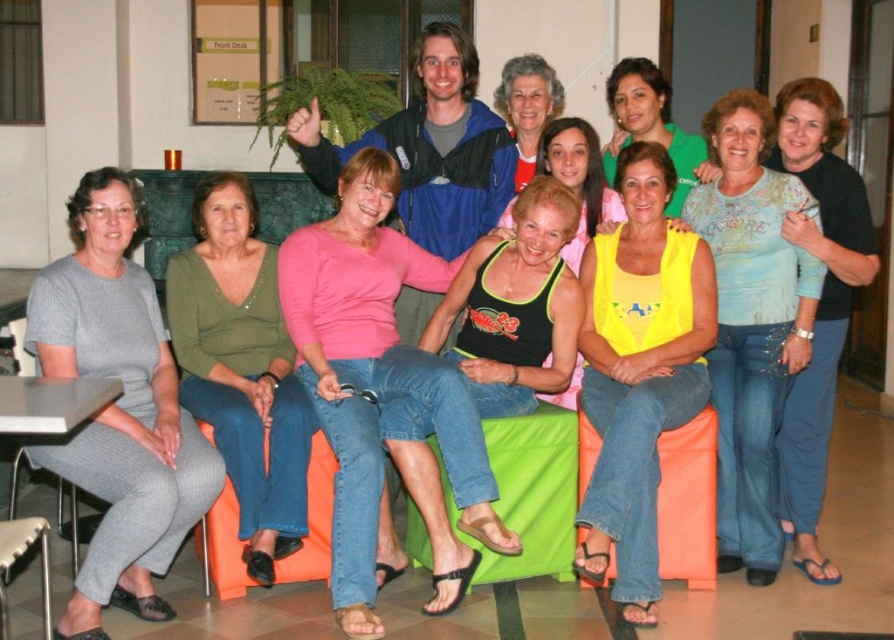
You are a photographer trying to capture a group photo of the matte green sweater at center and the black tank top at center. Since you want to ensure both are in focus, you need to know which one is taller. Can you tell me which is taller?

The matte green sweater at center is taller than the black tank top at center.

You are standing in the communal space and want to locate the yellow matte tank top at center. According to the coordinates provided, where should you look?

You should look at point [639,371] to find the yellow matte tank top at center.

You are organizing a charity clothing drive and need to determine if the yellow matte tank top at center can fit into a donation box that is the same size as the matte yellow tank top at center. Can it fit?

The yellow matte tank top at center might be wider than the matte yellow tank top at center, so it may not fit into the donation box of the same size as the matte yellow tank top at center.